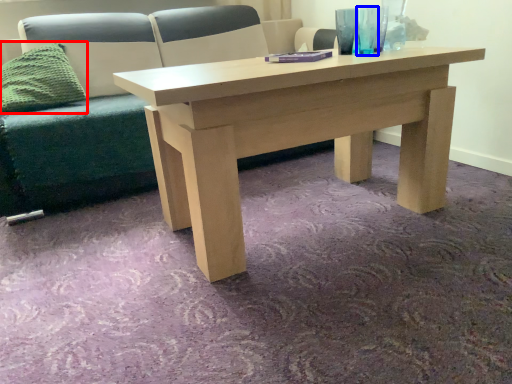
Question: Which object appears closest to the camera in this image, pillow (highlighted by a red box) or glass vase (highlighted by a blue box)?

Choices:
 (A) pillow
 (B) glass vase

Answer: (B)